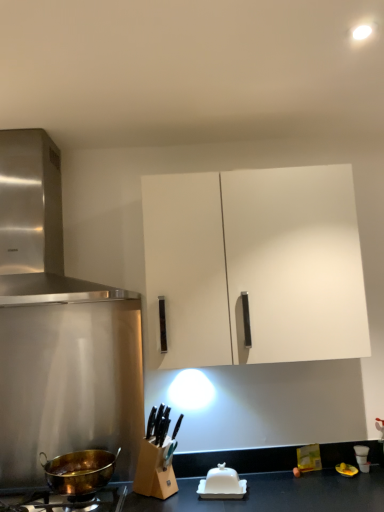
Question: Looking at their shapes, would you say white matte cabinet at upper center is wider or thinner than stainless steel range hood at upper left?

Choices:
 (A) thin
 (B) wide

Answer: (A)

Question: Looking at the image, does white matte cabinet at upper center seem bigger or smaller compared to stainless steel range hood at upper left?

Choices:
 (A) big
 (B) small

Answer: (B)

Question: Which object is positioned closest to the gold-bronze wok at lower left?

Choices:
 (A) gold metallic pot at lower left
 (B) white matte cabinet at upper center
 (C) white glossy butter dish at lower center
 (D) stainless steel range hood at upper left

Answer: (A)

Question: Which is farther from the white glossy butter dish at lower center?

Choices:
 (A) stainless steel range hood at upper left
 (B) white matte cabinet at upper center
 (C) gold-bronze wok at lower left
 (D) gold metallic pot at lower left

Answer: (A)